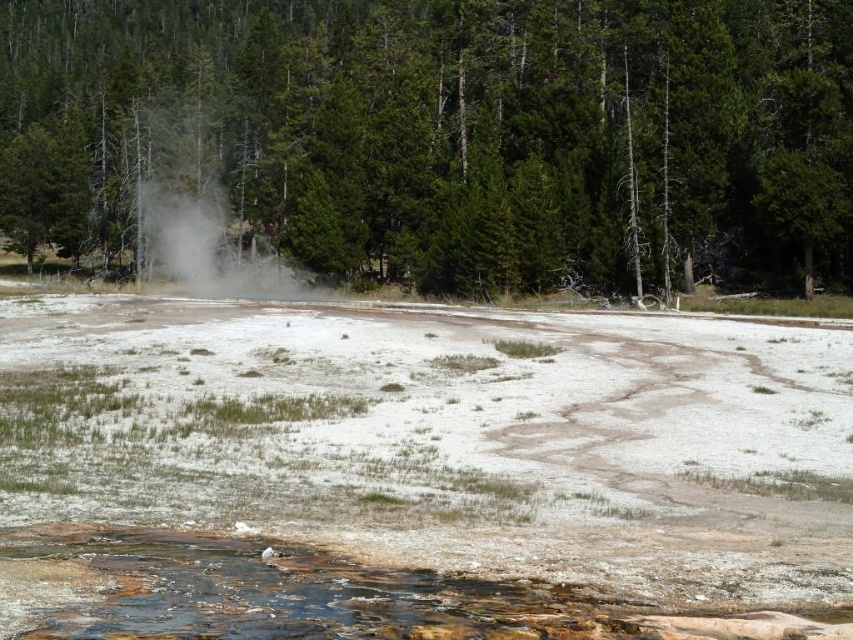
You are a park ranger assessing the geothermal area. You notice the green textured tree at center and the white vapor at center. Which object occupies a greater area in the scene?

The green textured tree at center has a larger size compared to the white vapor at center, so it occupies a greater area in the scene.

You are a park ranger assessing the safety of the area. You notice the green textured tree at center and the white vapor at center. Which object is closer to you, the observer?

The green textured tree at center is closer to you because it is positioned in front of the white vapor at center.

You are standing at the edge of the geothermal area and see two points in the scene. The first point is at coordinates point (537, 68), and the second is at point (233, 241). Which point is closer to you?

Point (537, 68) is closer to the viewer than point (233, 241).